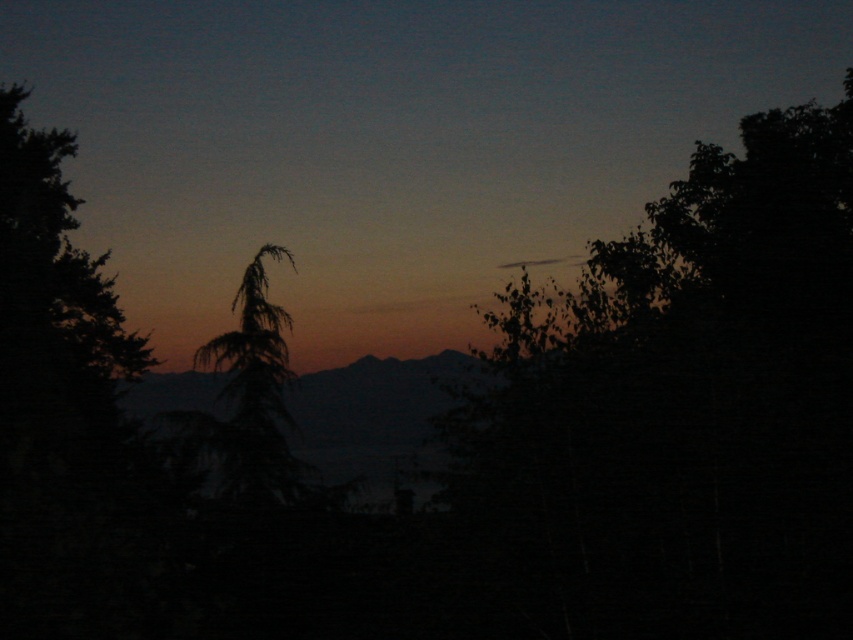
Does silhouette leafy tree at right appear under silhouette coniferous tree at center?

Incorrect, silhouette leafy tree at right is not positioned below silhouette coniferous tree at center.

From the picture: Does silhouette leafy tree at right have a lesser height compared to silhouette coniferous tree at center?

Incorrect, silhouette leafy tree at right's height does not fall short of silhouette coniferous tree at center's.

Does point (833, 152) lie in front of point (201, 352)?

Yes, point (833, 152) is in front of point (201, 352).

I want to click on silhouette leafy tree at right, so click(682, 412).